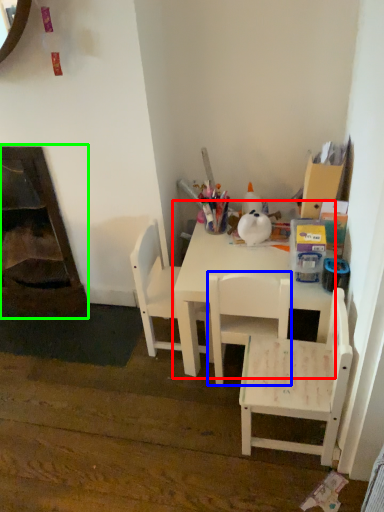
Question: Which is nearer to the table (highlighted by a red box)? chair (highlighted by a blue box) or fireplace (highlighted by a green box).

Choices:
 (A) chair
 (B) fireplace

Answer: (A)